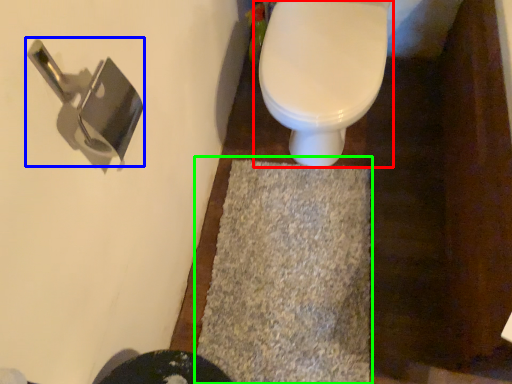
Question: Which is farther away from toilet (highlighted by a red box)? door handle (highlighted by a blue box) or bath mat (highlighted by a green box)?

Choices:
 (A) door handle
 (B) bath mat

Answer: (A)